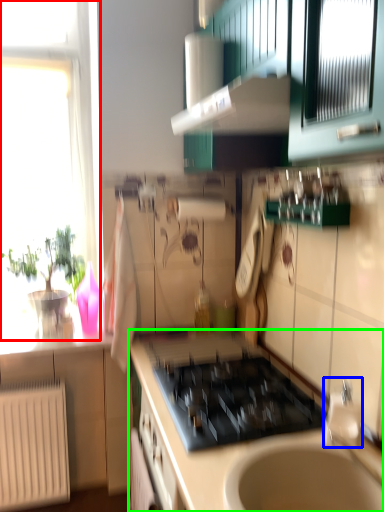
Question: Which object is positioned farthest from window (highlighted by a red box)? Select from faucet (highlighted by a blue box) and countertop (highlighted by a green box).

Choices:
 (A) faucet
 (B) countertop

Answer: (A)